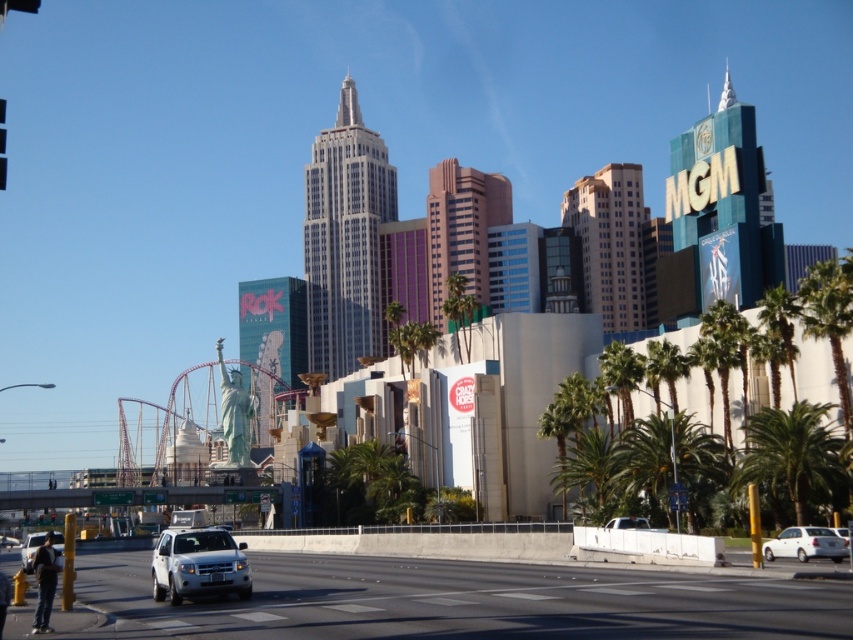
You are a drone operator trying to navigate between two points in the image. The first point is at coordinates point (x=833, y=486) and the second point is at coordinates point (x=181, y=561). Which point is closer to the statue resembling the Statue of Liberty?

Point (x=181, y=561) is closer to the statue resembling the Statue of Liberty because it is in front of point (x=833, y=486), which is behind it.

You are standing at the point marked by the coordinate point at (198, 564) in the image. Looking around, you see the white matte suv at lower left and the silver sedan at lower right. Which vehicle is closer to your current position?

The point at (198, 564) marks the white matte suv at lower left, so you are standing right at the white matte suv at lower left. Therefore, the white matte suv at lower left is at your current position, making it the closest vehicle to you.